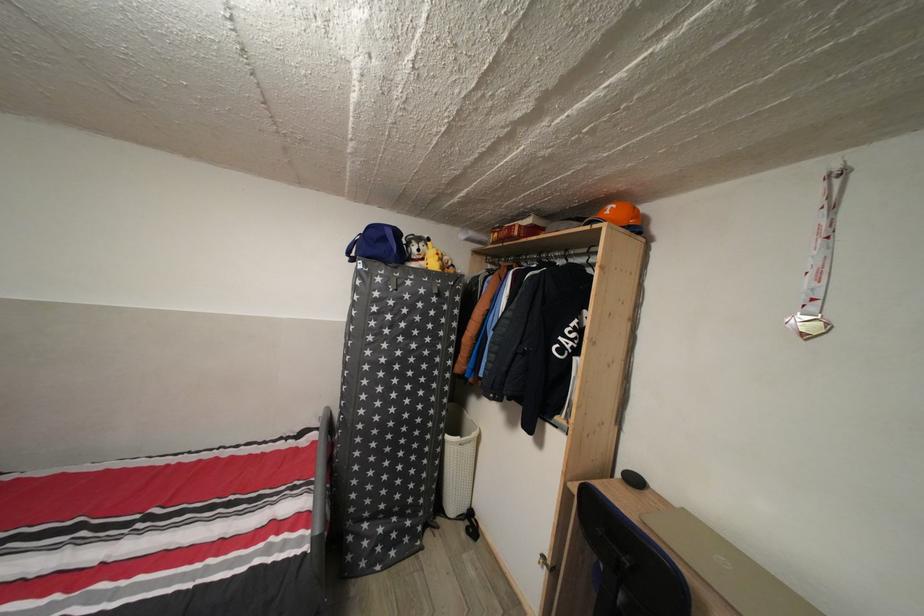
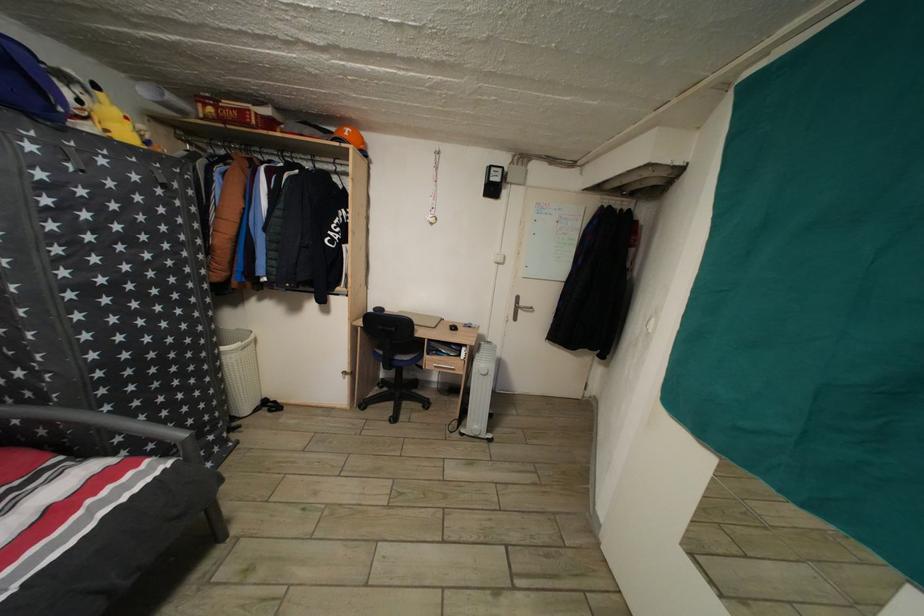
In the second image, find the point that corresponds to [455,444] in the first image.

(229, 355)